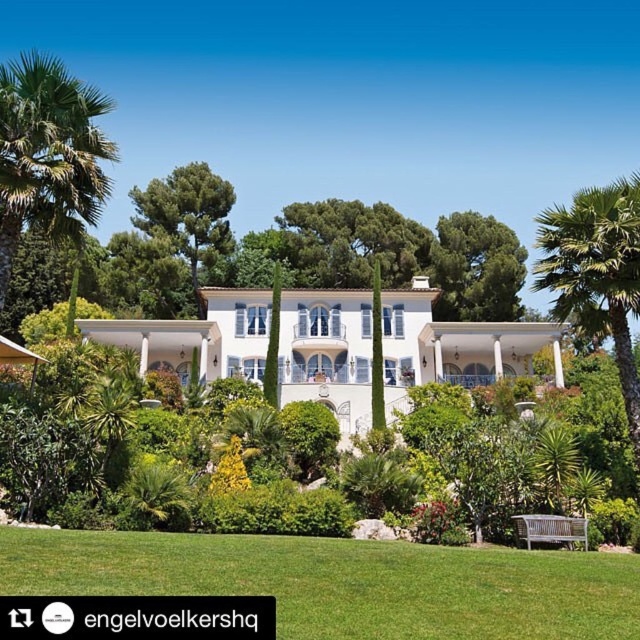
Question: Which object is positioned closest to the green leafy tree at upper center?

Choices:
 (A) green grass at center
 (B) green leafy palm tree at left

Answer: (B)

Question: Does green leafy palm tree at left have a smaller size compared to green leafy tree at upper center?

Choices:
 (A) yes
 (B) no

Answer: (B)

Question: Is green grass at center further to the viewer compared to white glossy mansion at center?

Choices:
 (A) no
 (B) yes

Answer: (A)

Question: Which object appears closest to the camera in this image?

Choices:
 (A) green grass at center
 (B) green leafy tree at upper center
 (C) green leafy palm tree at left
 (D) white glossy mansion at center

Answer: (A)

Question: Which object is the closest to the green grass at center?

Choices:
 (A) green leafy palm tree at left
 (B) green leafy tree at upper center
 (C) white glossy mansion at center

Answer: (A)

Question: Observing the image, what is the correct spatial positioning of white glossy mansion at center in reference to green leafy palm tree at left?

Choices:
 (A) right
 (B) left

Answer: (A)